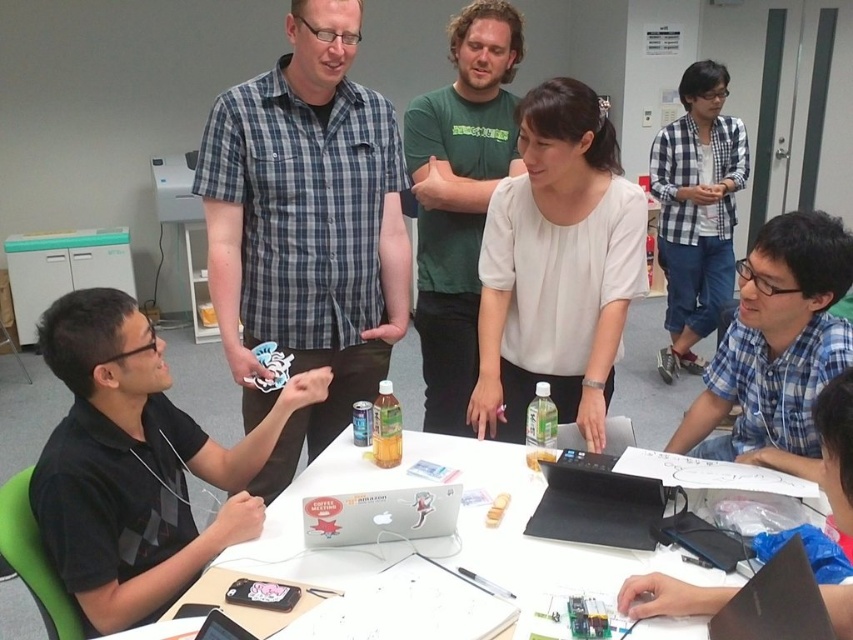
Who is positioned more to the right, green cotton shirt at center or blue plaid shirt at center?

blue plaid shirt at center

Between point (450, 412) and point (796, 401), which one is positioned in front?

Positioned in front is point (796, 401).

Where is `green cotton shirt at center`? green cotton shirt at center is located at coordinates (459, 196).

Is point (764, 230) positioned in front of point (410, 516)?

No, it is behind (410, 516).

Is blue plaid shirt at center to the left of silver metallic laptop at center from the viewer's perspective?

No, blue plaid shirt at center is not to the left of silver metallic laptop at center.

The width and height of the screenshot is (853, 640). What are the coordinates of `blue plaid shirt at center` in the screenshot? It's located at (776, 348).

Is blue plaid shirt at center further to camera compared to white paper at center?

That is True.

Locate an element on the screen. blue plaid shirt at center is located at coordinates (776, 348).

At what (x,y) coordinates should I click in order to perform the action: click on blue plaid shirt at center. Please return your answer as a coordinate pair (x, y). The width and height of the screenshot is (853, 640). Looking at the image, I should click on (776, 348).